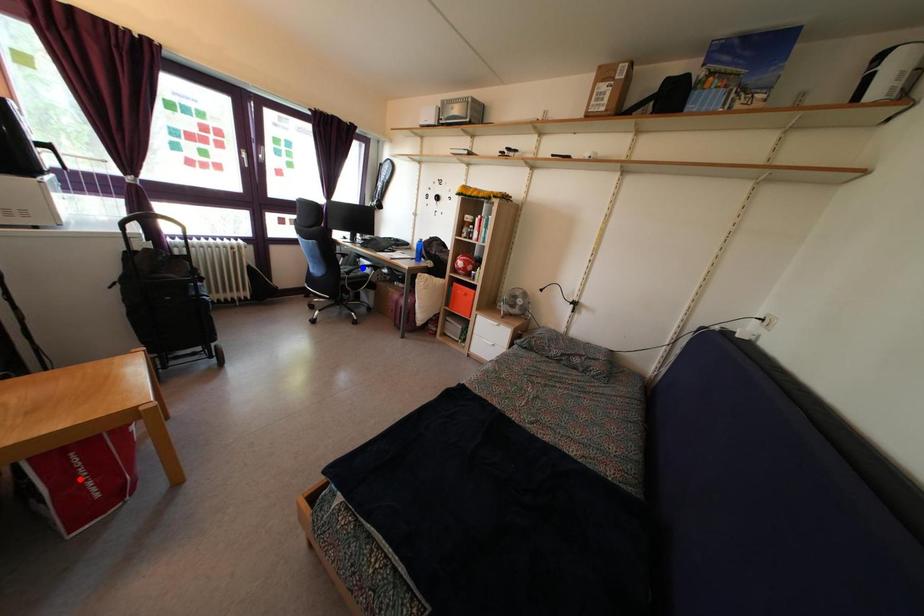
Question: Two points are marked on the image. Which point is closer to the camera?

Choices:
 (A) Blue point is closer.
 (B) Red point is closer.

Answer: (B)